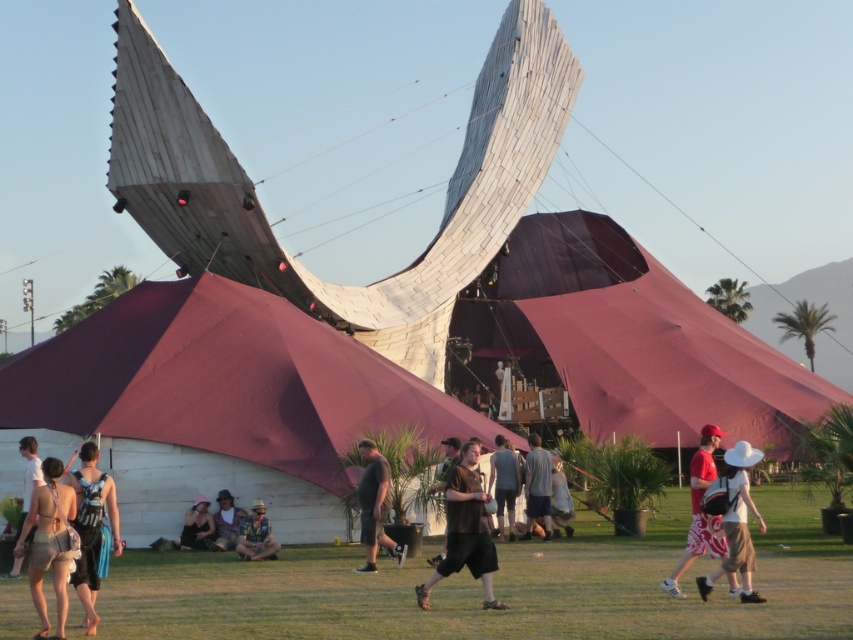
You are planning to set up a small booth for a festival. You need to know if there is enough space between the green grass at lower center and the maroon fabric canopy at center to place your booth. Can you determine if the space between them is sufficient?

The green grass at lower center is smaller than the maroon fabric canopy at center, so the space between them may be limited. However, without specific measurements of the distance between them, it is difficult to determine if it is sufficient for your booth.